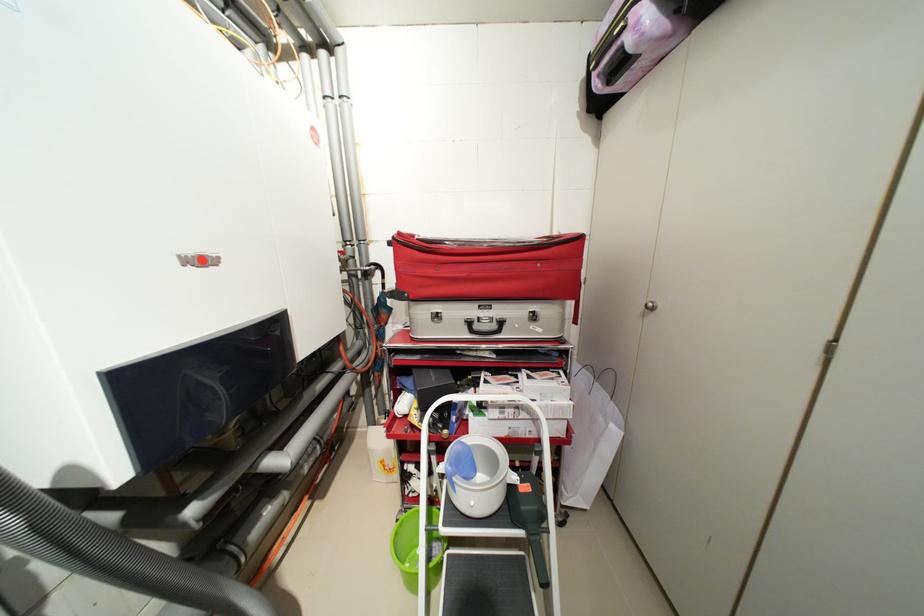
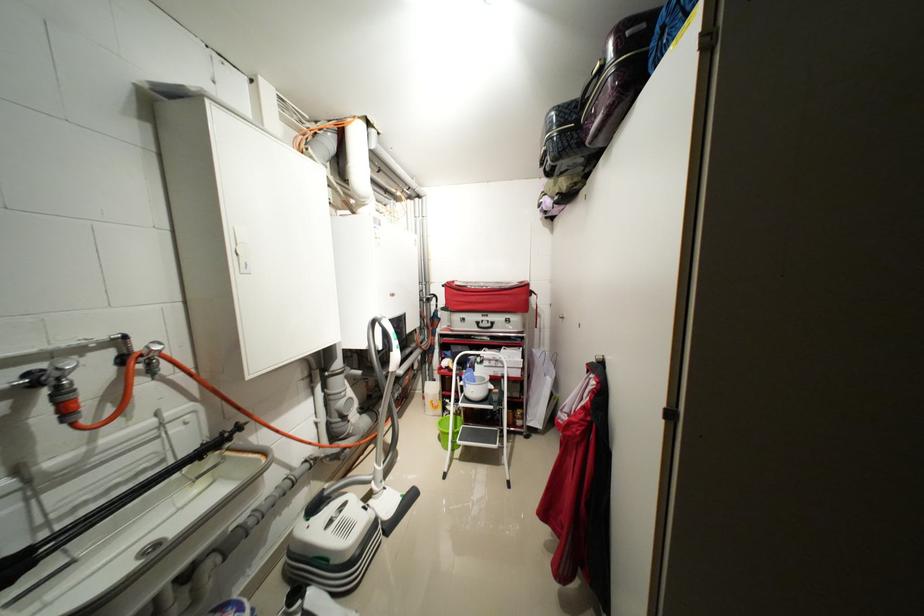
In the second image, find the point that corresponds to (407,235) in the first image.

(455, 284)